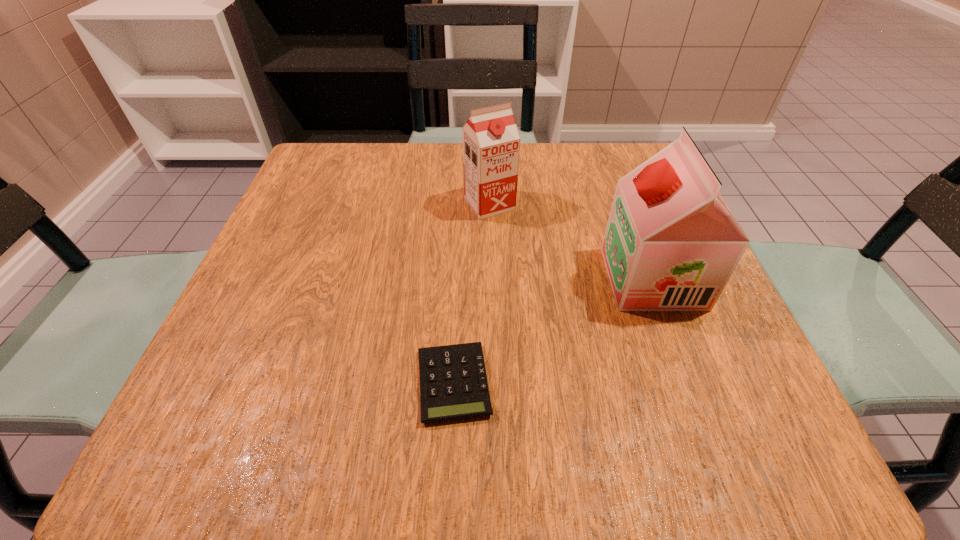
Locate an element on the screen. This screenshot has width=960, height=540. free spot located on the back of the shortest object is located at coordinates (457, 310).

Where is `object positioned at the far edge`? This screenshot has width=960, height=540. object positioned at the far edge is located at coordinates (491, 142).

Where is `object situated at the near edge`? Image resolution: width=960 pixels, height=540 pixels. object situated at the near edge is located at coordinates (453, 383).

This screenshot has height=540, width=960. Find the location of `object that is at the right edge`. object that is at the right edge is located at coordinates (671, 243).

The width and height of the screenshot is (960, 540). In the image, there is a desktop. In order to click on vacant space at the far edge in this screenshot , I will do `click(440, 168)`.

The width and height of the screenshot is (960, 540). Find the location of `free spot at the near edge of the desktop`. free spot at the near edge of the desktop is located at coordinates (505, 409).

This screenshot has height=540, width=960. Identify the location of vacant space at the left edge of the desktop. (316, 366).

The width and height of the screenshot is (960, 540). What are the coordinates of `vacant space at the far left corner` in the screenshot? It's located at (369, 168).

At what (x,y) coordinates should I click in order to perform the action: click on free space at the far right corner. Please return your answer as a coordinate pair (x, y). This screenshot has height=540, width=960. Looking at the image, I should click on (641, 152).

Find the location of a particular element. This screenshot has height=540, width=960. free space between the farthest object and the second nearest object is located at coordinates (571, 241).